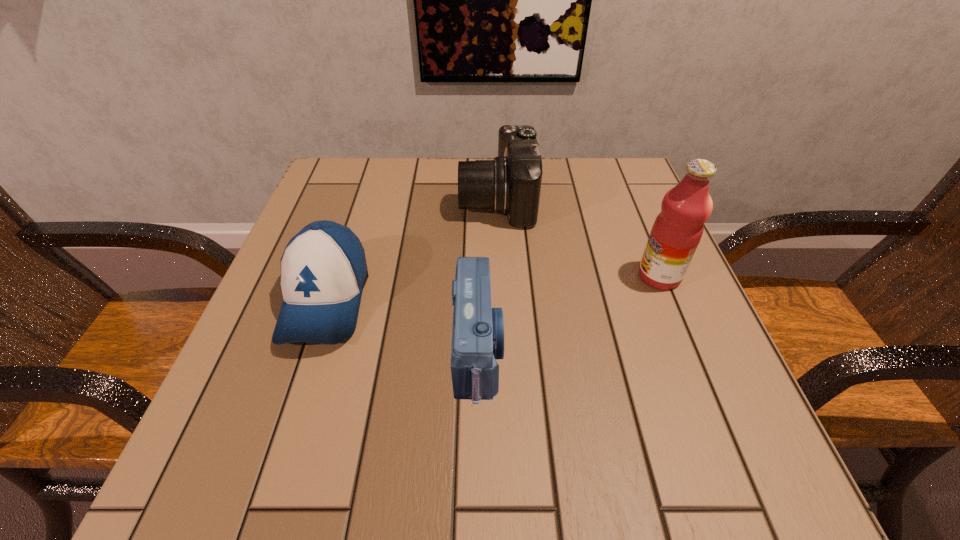
Where is `unoccupied area between the leftmost object and the farthest object`? This screenshot has width=960, height=540. unoccupied area between the leftmost object and the farthest object is located at coordinates (412, 250).

At what (x,y) coordinates should I click in order to perform the action: click on vacant area that lies between the baseball cap and the farthest object. Please return your answer as a coordinate pair (x, y). Looking at the image, I should click on (412, 250).

Locate which object ranks second in proximity to the baseball cap. Please provide its 2D coordinates. Your answer should be formatted as a tuple, i.e. [(x, y)], where the tuple contains the x and y coordinates of a point satisfying the conditions above.

[(510, 184)]

This screenshot has height=540, width=960. What are the coordinates of `object that can be found as the closest to the baseball cap` in the screenshot? It's located at [x=478, y=329].

Locate an element on the screen. The image size is (960, 540). free spot that satisfies the following two spatial constraints: 1. on the label of the fruit juice; 2. on the front-facing side of the baseball cap is located at coordinates (669, 300).

Where is `vacant space that satisfies the following two spatial constraints: 1. on the lens of the farthest object; 2. on the front-facing side of the leftmost object`? Image resolution: width=960 pixels, height=540 pixels. vacant space that satisfies the following two spatial constraints: 1. on the lens of the farthest object; 2. on the front-facing side of the leftmost object is located at coordinates (502, 300).

Locate an element on the screen. blank space that satisfies the following two spatial constraints: 1. on the label of the tallest object; 2. on the front-facing side of the leftmost object is located at coordinates (669, 300).

This screenshot has height=540, width=960. What are the coordinates of `vacant position in the image that satisfies the following two spatial constraints: 1. on the label of the fruit juice; 2. on the front-facing side of the baseball cap` in the screenshot? It's located at pyautogui.click(x=669, y=300).